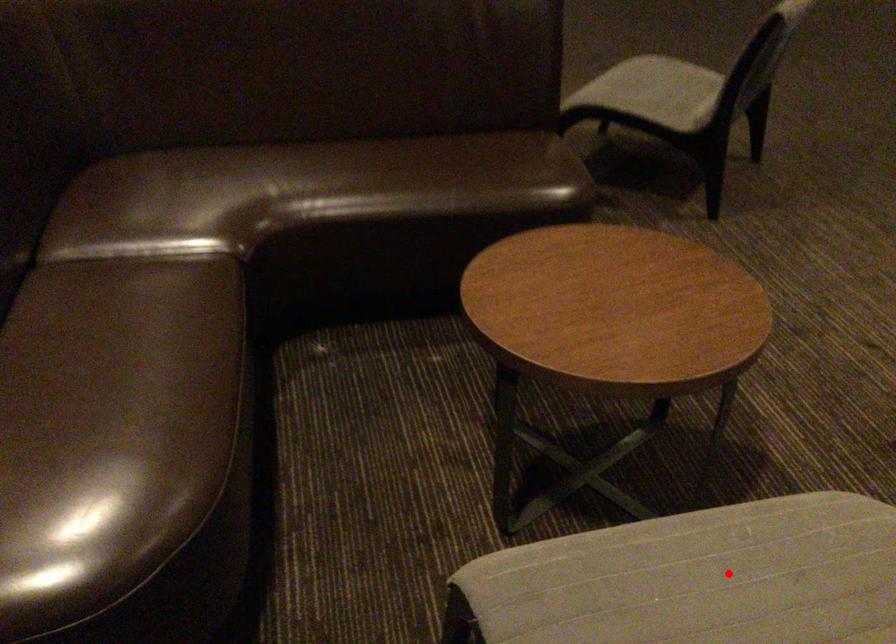
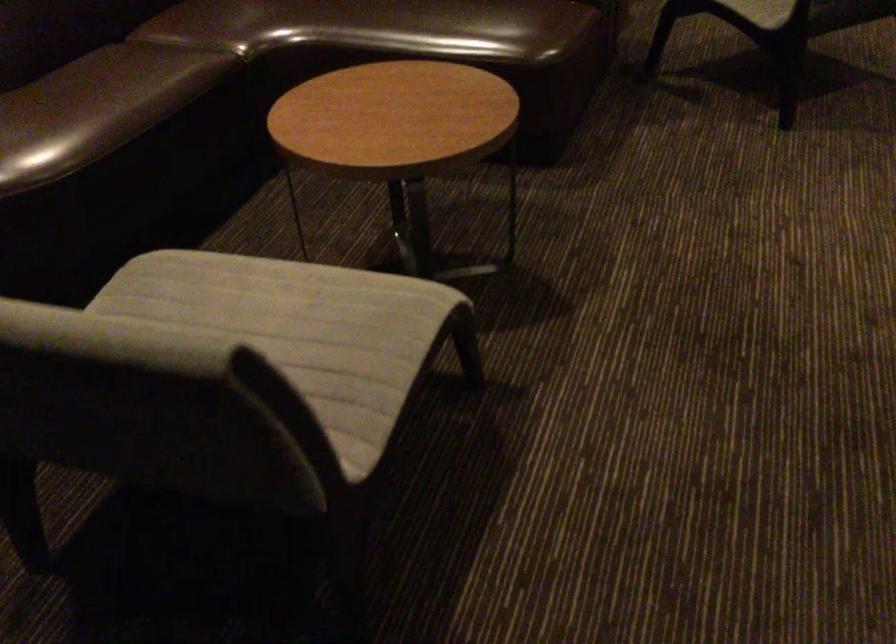
Find the pixel in the second image that matches the highlighted location in the first image.

(280, 299)